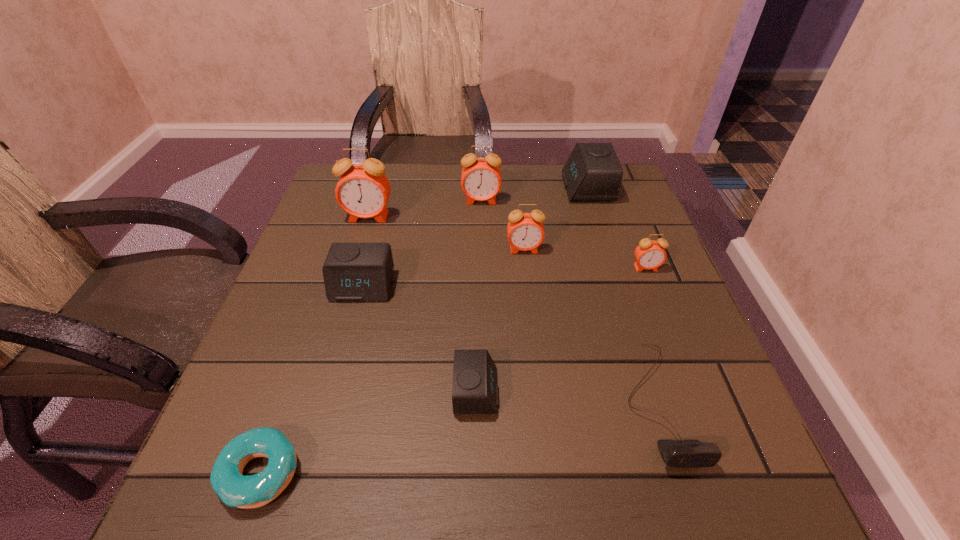
What are the coordinates of `the third farthest object` in the screenshot? It's located at [363, 190].

Identify the location of the tallest alarm clock. The image size is (960, 540). (363, 190).

This screenshot has width=960, height=540. Identify the location of the second tallest object. (481, 178).

The width and height of the screenshot is (960, 540). I want to click on the second pink alarm clock from left to right, so click(481, 178).

At what (x,y) coordinates should I click in order to perform the action: click on the fifth shortest alarm clock. Please return your answer as a coordinate pair (x, y). Looking at the image, I should click on (525, 231).

Identify the location of the second nearest pink alarm clock. (525, 231).

Locate an element on the screen. This screenshot has height=540, width=960. the farthest black alarm clock is located at coordinates (593, 172).

Locate an element on the screen. The height and width of the screenshot is (540, 960). the biggest black alarm clock is located at coordinates (593, 172).

At what (x,y) coordinates should I click in order to perform the action: click on the rightmost pink alarm clock. Please return your answer as a coordinate pair (x, y). Looking at the image, I should click on (650, 254).

In order to click on the smallest pink alarm clock in this screenshot , I will do `click(650, 254)`.